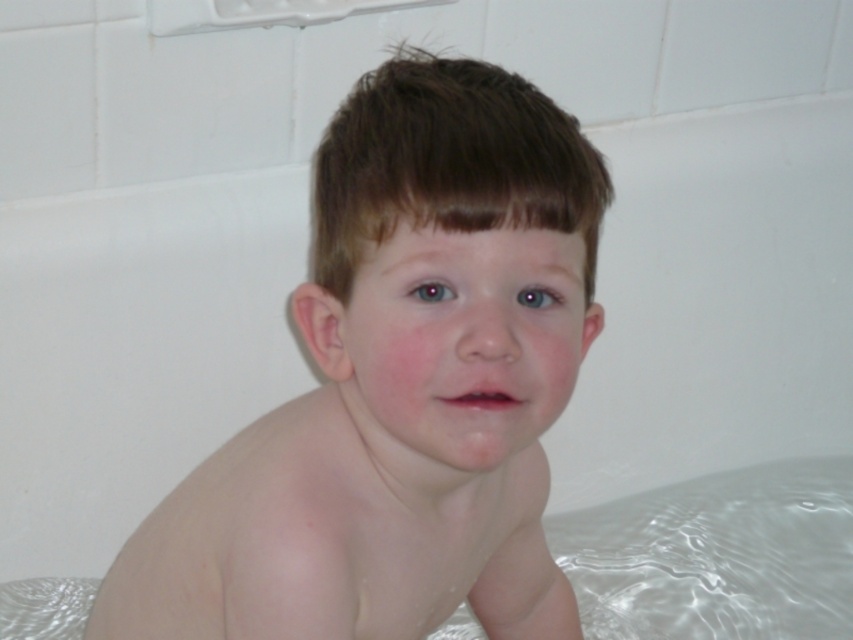
Question: Which object is closer to the camera taking this photo?

Choices:
 (A) transparent plastic diaper at lower left
 (B) pale skin child at center

Answer: (B)

Question: Does pale skin child at center appear over transparent plastic diaper at lower left?

Choices:
 (A) no
 (B) yes

Answer: (B)

Question: Among these objects, which one is nearest to the camera?

Choices:
 (A) pale skin child at center
 (B) transparent plastic diaper at lower left

Answer: (A)

Question: Does pale skin child at center come behind transparent plastic diaper at lower left?

Choices:
 (A) no
 (B) yes

Answer: (A)

Question: Does pale skin child at center appear on the right side of transparent plastic diaper at lower left?

Choices:
 (A) no
 (B) yes

Answer: (B)